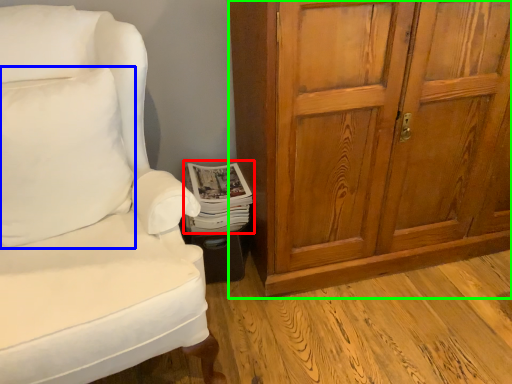
Question: Based on their relative distances, which object is farther from magazine (highlighted by a red box)? Choose from pillow (highlighted by a blue box) and cabinetry (highlighted by a green box).

Choices:
 (A) pillow
 (B) cabinetry

Answer: (B)